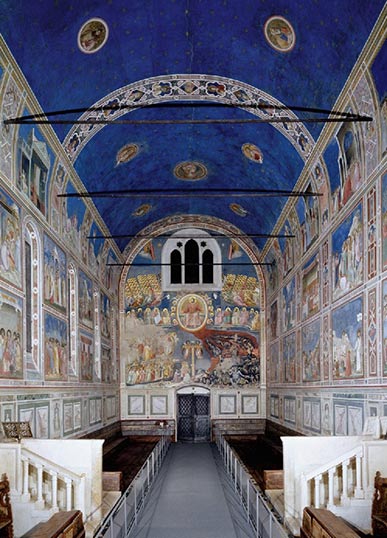
The image size is (387, 538). I want to click on doors, so [187, 408], [201, 409].